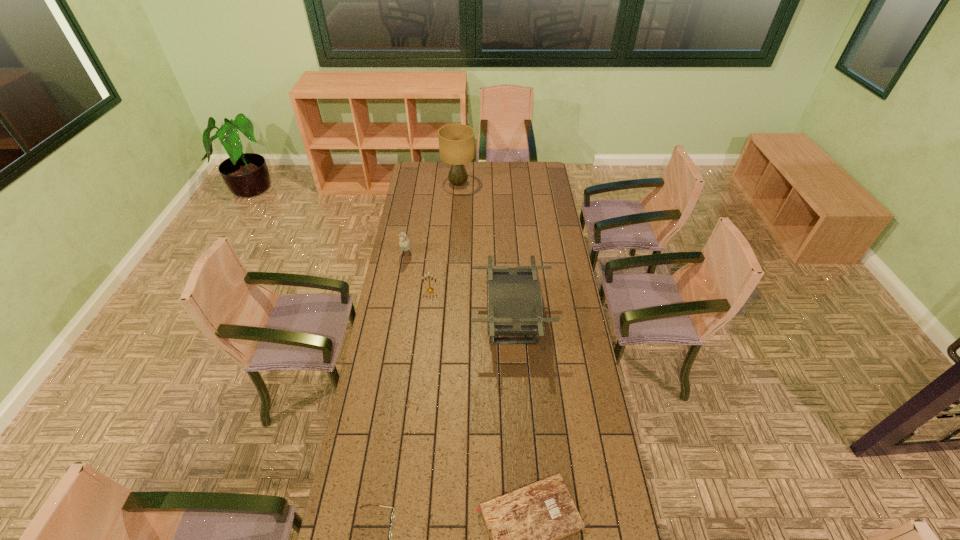
Locate an element on the screen. The height and width of the screenshot is (540, 960). free spot between the third shortest object and the fifth shortest object is located at coordinates (471, 306).

This screenshot has height=540, width=960. I want to click on free space between the second farthest object and the fourth tallest object, so click(x=419, y=273).

Image resolution: width=960 pixels, height=540 pixels. In order to click on free space between the fourth tallest object and the bird in this screenshot , I will do `click(419, 273)`.

The image size is (960, 540). Identify the location of vacant region between the fifth nearest object and the tallest object. (432, 220).

The width and height of the screenshot is (960, 540). Find the location of `free space between the bird and the fifth shortest object`. free space between the bird and the fifth shortest object is located at coordinates (459, 288).

Select which object is the fifth closest to the fifth shortest object. Please provide its 2D coordinates. Your answer should be formatted as a tuple, i.e. [(x, y)], where the tuple contains the x and y coordinates of a point satisfying the conditions above.

[(456, 141)]

Select which object appears as the fourth closest to the farthest object. Please provide its 2D coordinates. Your answer should be formatted as a tuple, i.e. [(x, y)], where the tuple contains the x and y coordinates of a point satisfying the conditions above.

[(525, 525)]